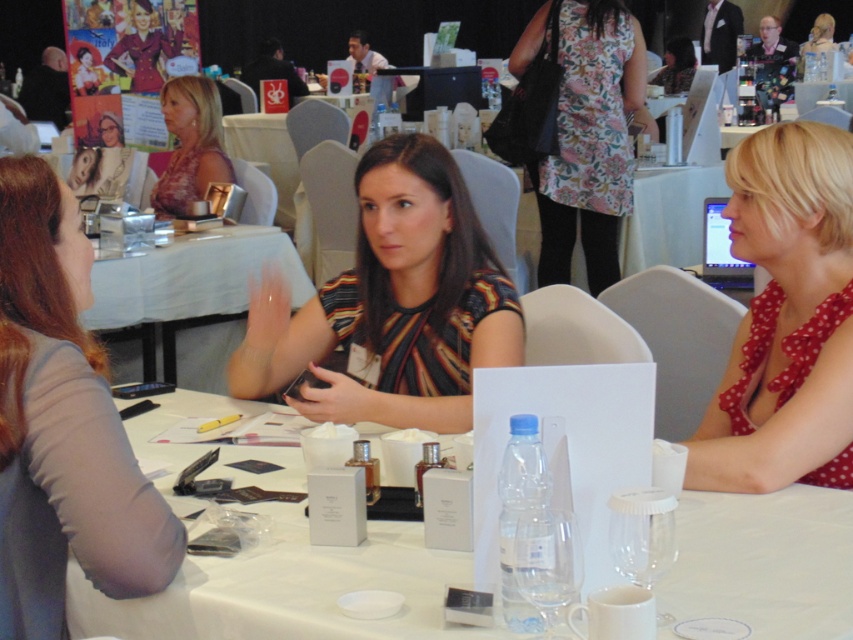
From the picture: Is striped fabric shirt at center wider than floral fabric dress at center?

Indeed, striped fabric shirt at center has a greater width compared to floral fabric dress at center.

Who is higher up, striped fabric shirt at center or floral fabric dress at center?

floral fabric dress at center

Locate an element on the screen. striped fabric shirt at center is located at coordinates (393, 304).

Can you confirm if striped fabric shirt at center is taller than polka dot fabric dress at right?

No.

Is striped fabric shirt at center closer to camera compared to polka dot fabric dress at right?

Result: No, striped fabric shirt at center is further to the viewer.

Where is `striped fabric shirt at center`? Image resolution: width=853 pixels, height=640 pixels. striped fabric shirt at center is located at coordinates (393, 304).

Does gray fabric shirt at left appear over polka dot fabric dress at right?

Incorrect, gray fabric shirt at left is not positioned above polka dot fabric dress at right.

Does gray fabric shirt at left have a lesser width compared to polka dot fabric dress at right?

Yes, gray fabric shirt at left is thinner than polka dot fabric dress at right.

Who is more distant from viewer, (73, 429) or (807, 218)?

Point (807, 218)

In order to click on gray fabric shirt at left in this screenshot , I will do point(62,426).